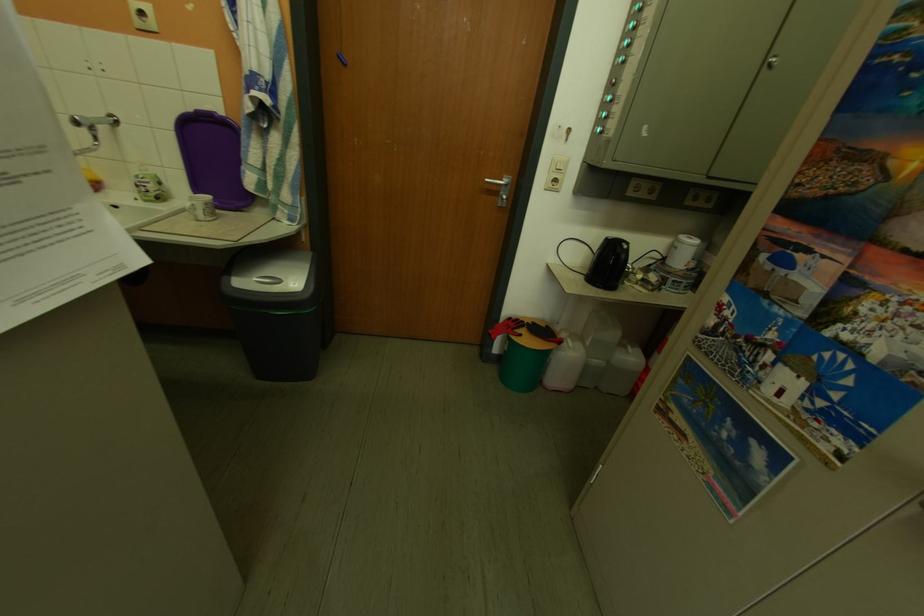
The width and height of the screenshot is (924, 616). What do you see at coordinates (93, 124) in the screenshot?
I see `the faucet lever` at bounding box center [93, 124].